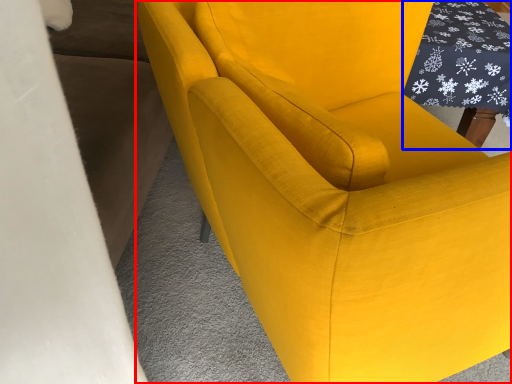
Question: Which object appears farthest to the camera in this image, chair (highlighted by a red box) or table (highlighted by a blue box)?

Choices:
 (A) chair
 (B) table

Answer: (B)